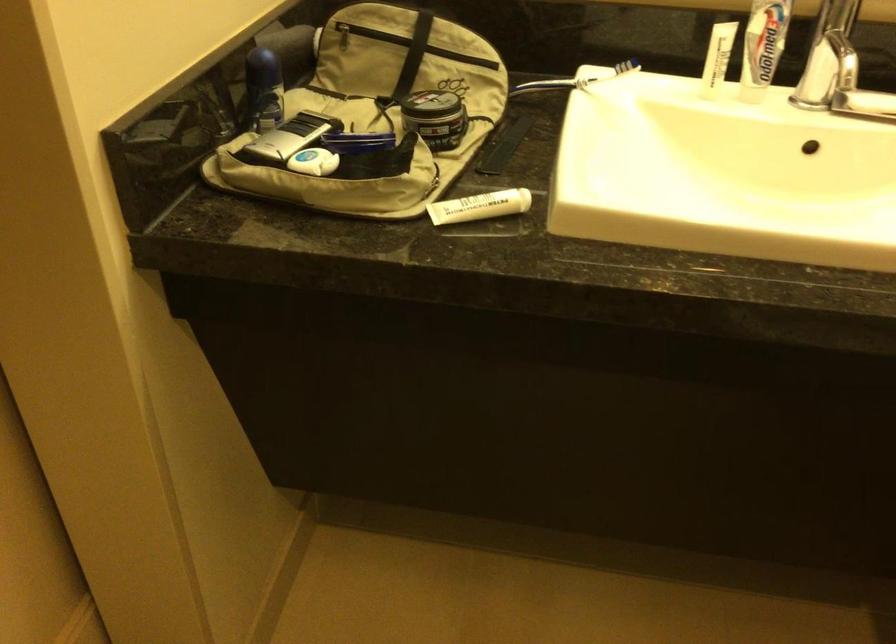
The height and width of the screenshot is (644, 896). In order to click on white toothpaste tube in this screenshot , I will do `click(479, 205)`.